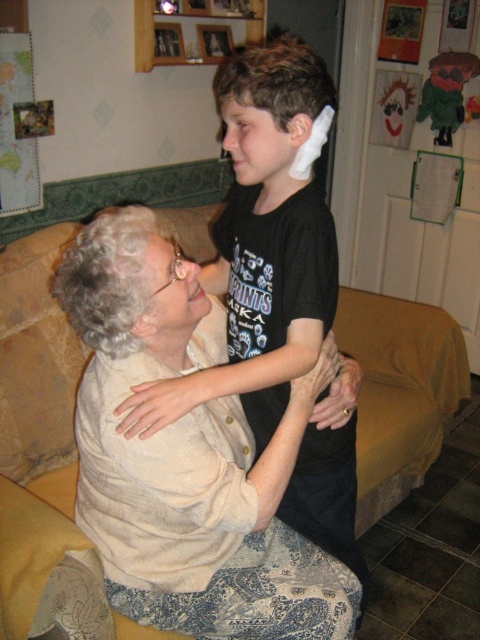
Is light beige fabric at center taller than black matte shirt at upper center?

No, light beige fabric at center is not taller than black matte shirt at upper center.

Does light beige fabric at center appear over black matte shirt at upper center?

Actually, light beige fabric at center is below black matte shirt at upper center.

Does point (217, 536) come behind point (252, 320)?

That is False.

Image resolution: width=480 pixels, height=640 pixels. Find the location of `light beige fabric at center`. light beige fabric at center is located at coordinates (187, 456).